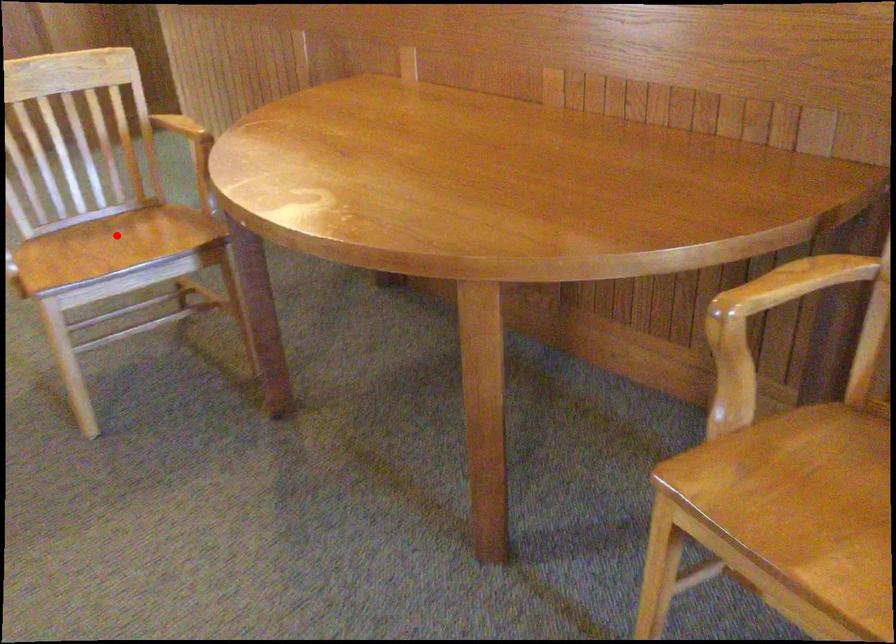
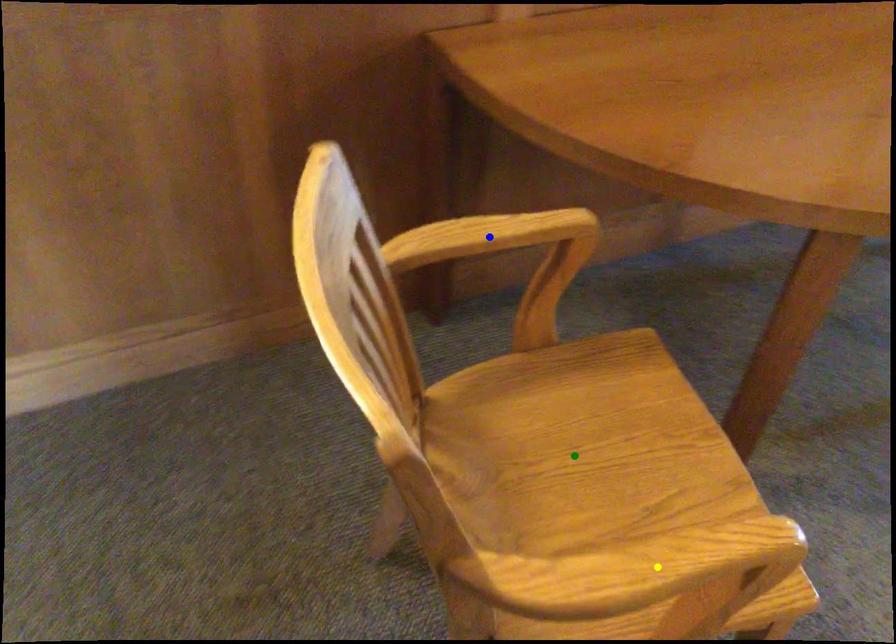
Question: I am providing you with two images of the same scene from different viewpoints. A red point is marked on the first image. You are given multiple points on the second image. Can you choose the point in image 2 that corresponds to the point in image 1?

Choices:
 (A) blue point
 (B) green point
 (C) yellow point

Answer: (B)